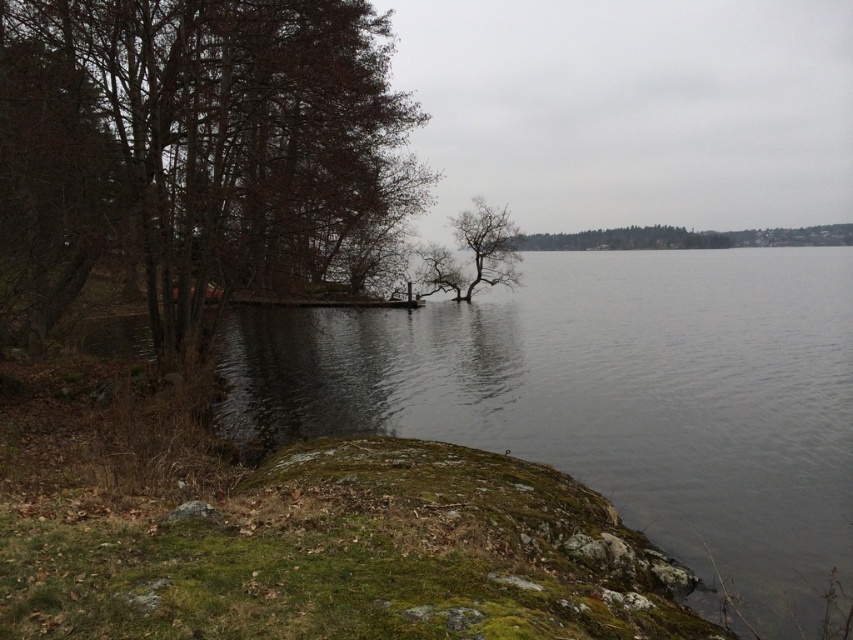
Question: Among these objects, which one is farthest from the camera?

Choices:
 (A) bare branches at center
 (B) green leafy tree at center
 (C) clear water at lower left

Answer: (B)

Question: Is brown leafy tree at left above bare branches at center?

Choices:
 (A) no
 (B) yes

Answer: (B)

Question: Is clear water at lower left behind bare branches at center?

Choices:
 (A) no
 (B) yes

Answer: (A)

Question: Which object appears farthest from the camera in this image?

Choices:
 (A) green leafy tree at center
 (B) clear water at lower left
 (C) bare branches at center

Answer: (A)

Question: Which object appears closest to the camera in this image?

Choices:
 (A) green leafy tree at center
 (B) brown leafy tree at left

Answer: (B)

Question: Is bare branches at center to the right of green leafy tree at center from the viewer's perspective?

Choices:
 (A) no
 (B) yes

Answer: (A)